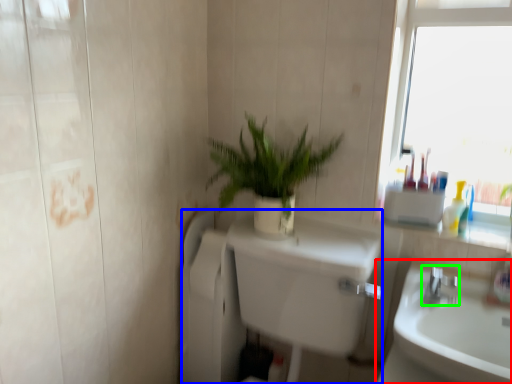
Question: Estimate the real-world distances between objects in this image. Which object is closer to sink (highlighted by a red box), bath (highlighted by a blue box) or tap (highlighted by a green box)?

Choices:
 (A) bath
 (B) tap

Answer: (B)